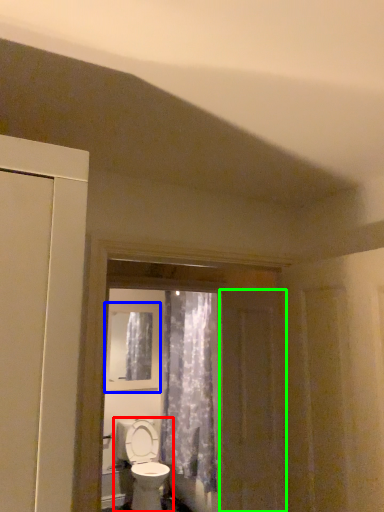
Question: Based on their relative distances, which object is nearer to toilet (highlighted by a red box)? Choose from window (highlighted by a blue box) and screen door (highlighted by a green box).

Choices:
 (A) window
 (B) screen door

Answer: (A)